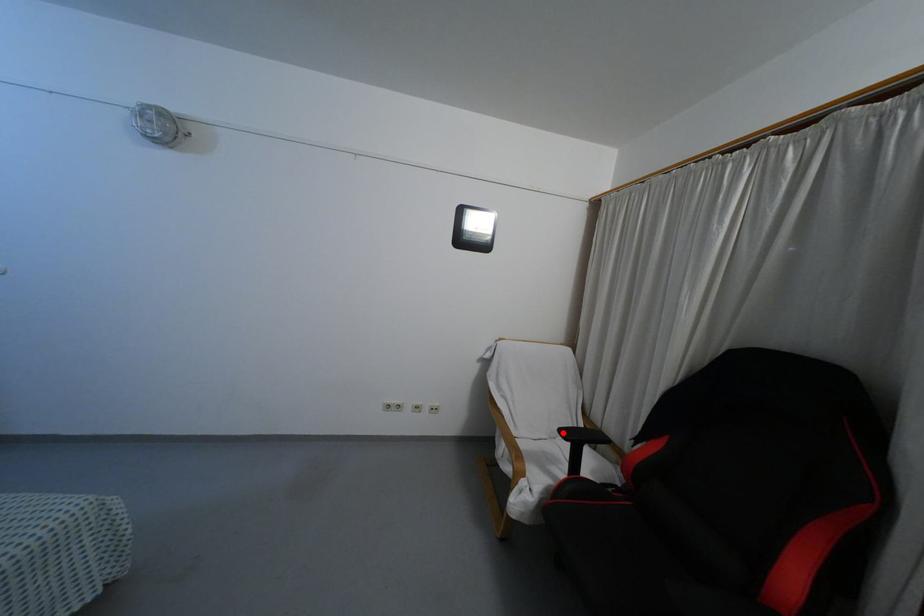
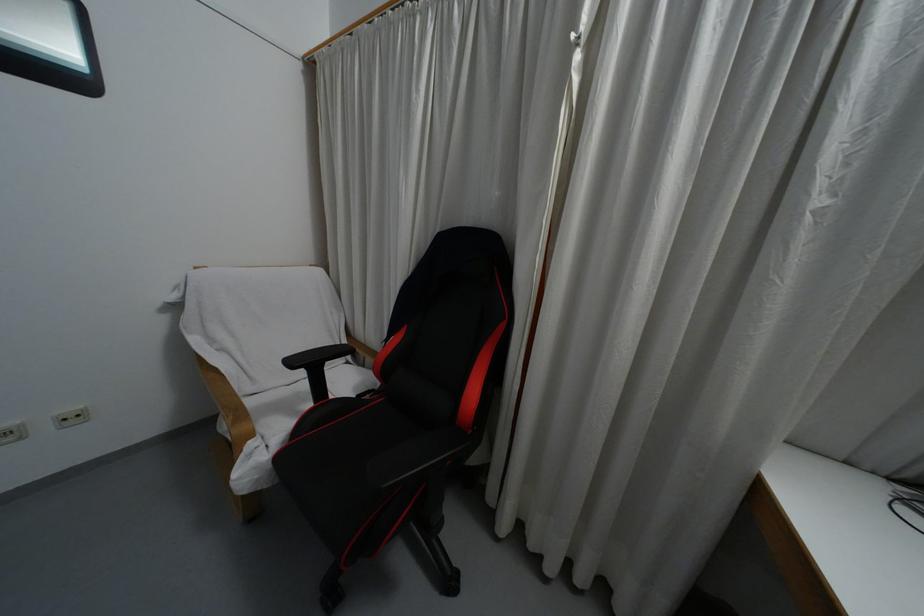
In the second image, find the point that corresponds to the highlighted location in the first image.

(292, 362)